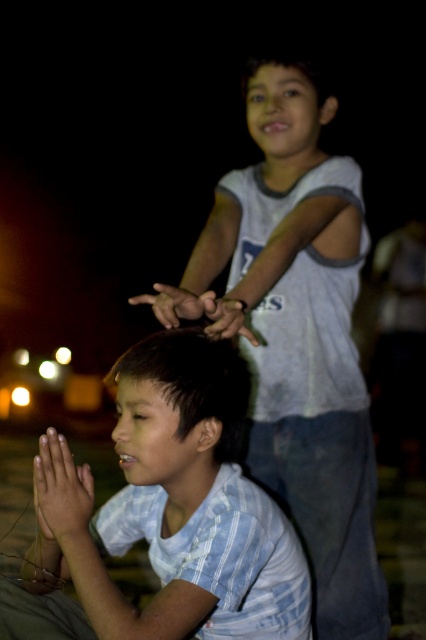
Is matte skin hand at center bigger than smooth skin hand at center?

Yes.

Is matte skin hand at center further to the viewer compared to smooth skin hand at center?

No.

This screenshot has height=640, width=426. What do you see at coordinates (175, 301) in the screenshot? I see `matte skin hand at center` at bounding box center [175, 301].

This screenshot has width=426, height=640. What are the coordinates of `matte skin hand at center` in the screenshot? It's located at (175, 301).

Based on the photo, does white cotton shirt at upper center appear under smooth skin hand at center?

Indeed, white cotton shirt at upper center is positioned under smooth skin hand at center.

Who is more distant from viewer, (362,198) or (232,314)?

Positioned behind is point (362,198).

Between point (284, 468) and point (236, 314), which one is positioned behind?

Positioned behind is point (284, 468).

Identify the location of white cotton shirt at upper center. This screenshot has width=426, height=640. (304, 340).

Is smooth skin hands at center taller than matte skin hand at center?

Yes, smooth skin hands at center is taller than matte skin hand at center.

Does smooth skin hands at center appear under matte skin hand at center?

Yes.

Which is behind, point (88, 522) or point (180, 308)?

Point (180, 308)

The width and height of the screenshot is (426, 640). I want to click on smooth skin hands at center, so click(x=62, y=492).